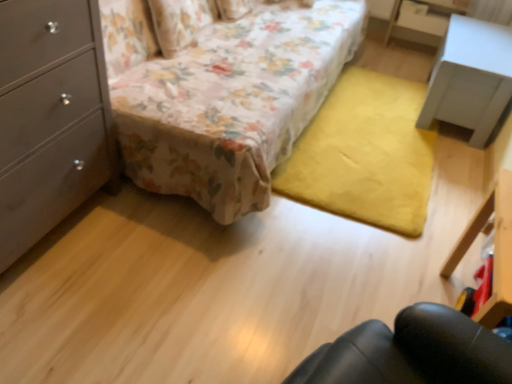
You are a GUI agent. You are given a task and a screenshot of the screen. Output one action in this format:
    pyautogui.click(x=<x>, y=<y>)
    Task: Click on the free location to the left of black plastic vanity at lower right
    The height and width of the screenshot is (384, 512).
    Given the screenshot: What is the action you would take?
    pyautogui.click(x=350, y=283)